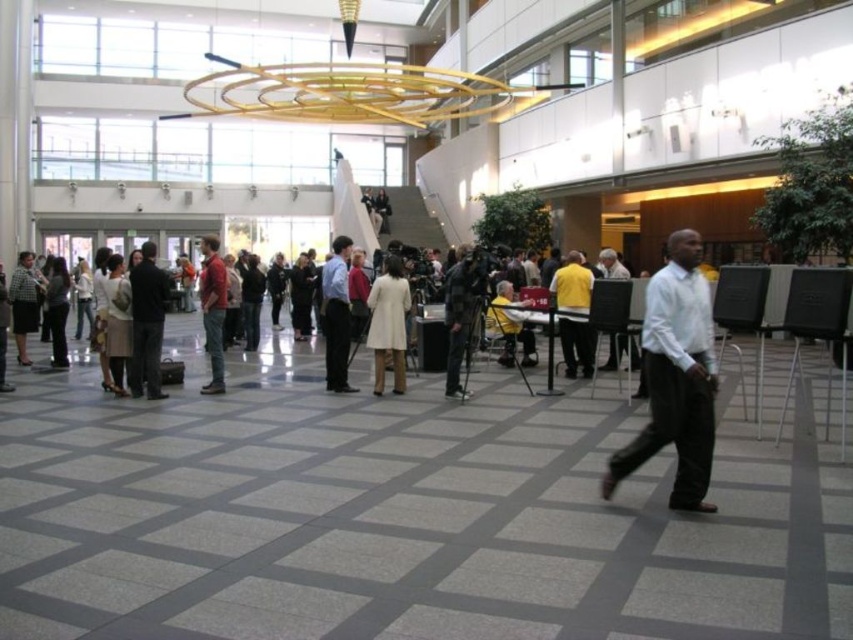
Does dark gray pants at center have a lesser height compared to plaid fabric jacket at left?

No, dark gray pants at center is not shorter than plaid fabric jacket at left.

Does point (144, 323) lie behind point (28, 253)?

No, it is not.

This screenshot has height=640, width=853. I want to click on dark gray pants at center, so click(x=148, y=323).

Does point (709, 355) come farther from viewer compared to point (572, 291)?

No.

Which is behind, point (608, 480) or point (590, 280)?

The point (590, 280) is behind.

This screenshot has height=640, width=853. I want to click on white shirt at center, so [675, 378].

Does matte black camera at center have a smaller size compared to plaid fabric jacket at left?

Actually, matte black camera at center might be larger than plaid fabric jacket at left.

Between point (471, 314) and point (38, 307), which one is positioned in front?

Point (471, 314) is in front.

Is point (459, 321) farther from camera compared to point (36, 307)?

No, it is in front of (36, 307).

Locate an element on the screen. The image size is (853, 640). matte black camera at center is located at coordinates (461, 310).